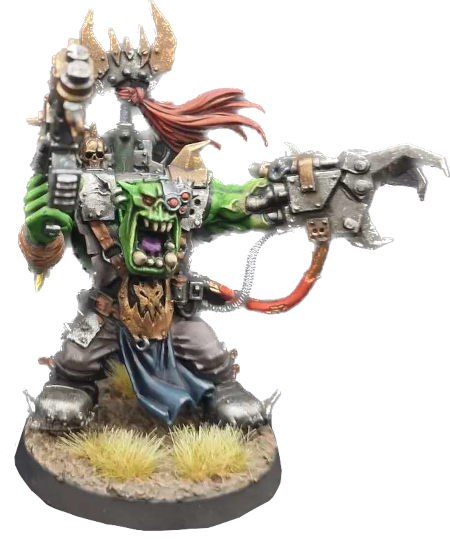
Locate an element on the screen. monster figurine is located at coordinates (141, 222).